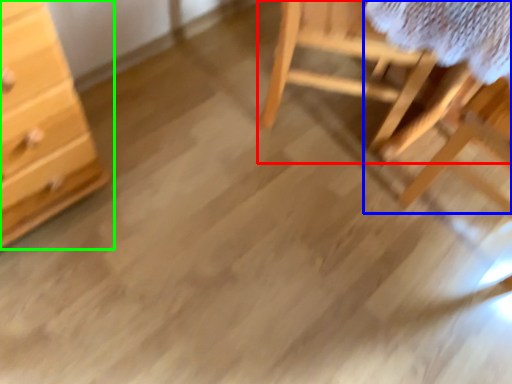
Question: Based on their relative distances, which object is farther from furniture (highlighted by a red box)? Choose from table (highlighted by a blue box) and chest of drawers (highlighted by a green box).

Choices:
 (A) table
 (B) chest of drawers

Answer: (B)